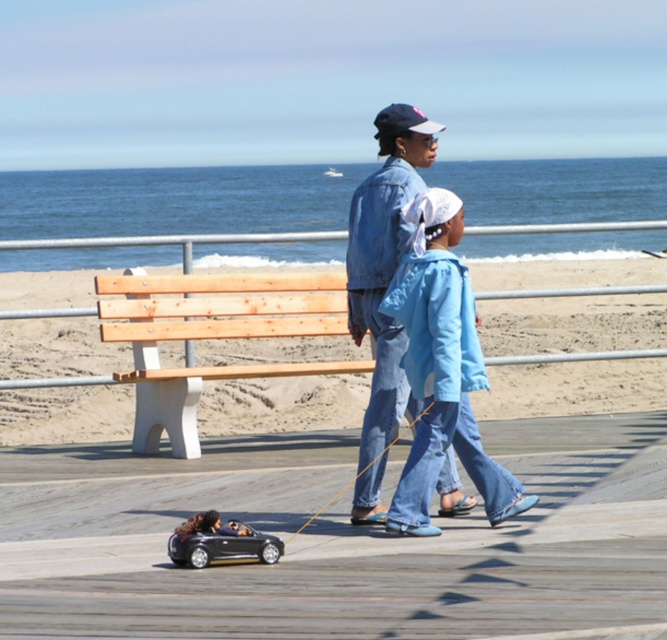
Question: Is blue denim jacket at center further to the viewer compared to dark blue fabric baseball cap at upper center?

Choices:
 (A) yes
 (B) no

Answer: (B)

Question: Which point is closer to the camera taking this photo?

Choices:
 (A) (205, 365)
 (B) (408, 120)

Answer: (B)

Question: Which object appears closest to the camera in this image?

Choices:
 (A) dark blue fabric baseball cap at upper center
 (B) shiny metallic toy car at lower center

Answer: (B)

Question: Observing the image, what is the correct spatial positioning of natural wood bench at center in reference to shiny metallic toy car at lower center?

Choices:
 (A) right
 (B) left

Answer: (A)

Question: Which point is closer to the camera?

Choices:
 (A) wooden bench at center
 (B) dark blue fabric baseball cap at upper center

Answer: (B)

Question: Can you confirm if shiny metallic toy car at lower center is positioned below dark blue fabric baseball cap at upper center?

Choices:
 (A) yes
 (B) no

Answer: (A)